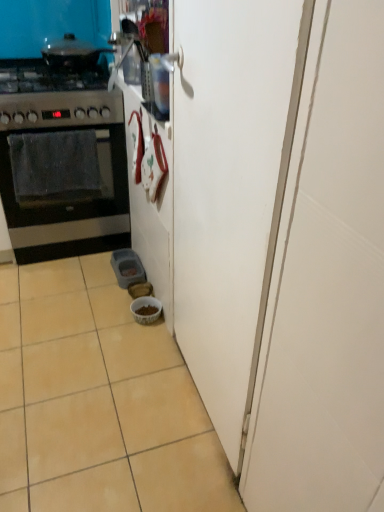
Locate an element on the screen. The height and width of the screenshot is (512, 384). free location above beige ceramic tile at lower left (from a real-world perspective) is located at coordinates (89, 364).